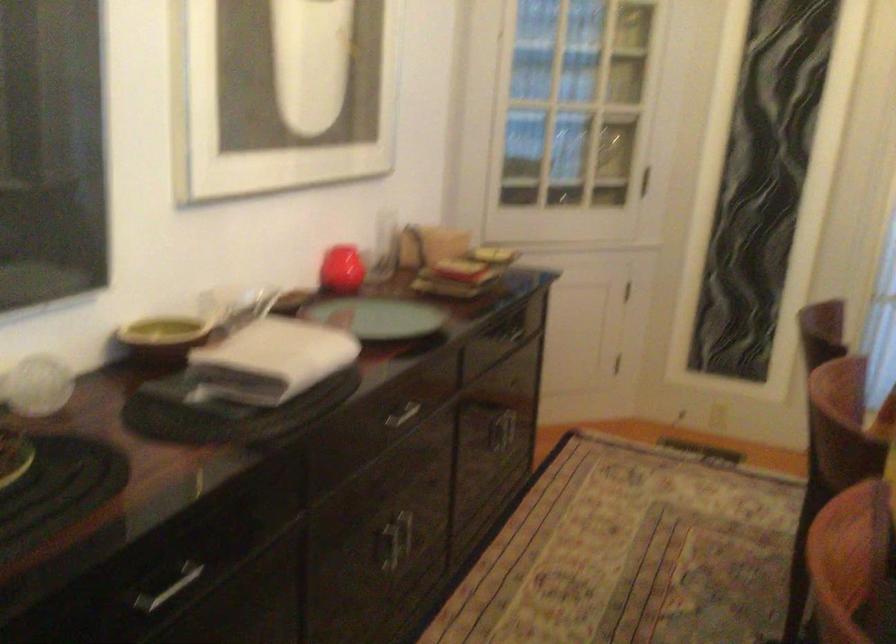
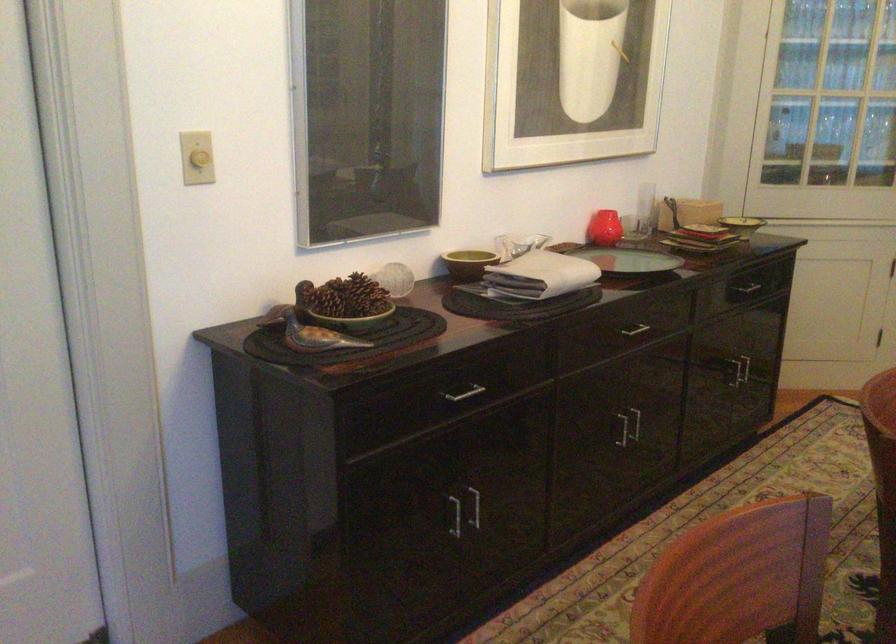
The point at (400,526) is marked in the first image. Where is the corresponding point in the second image?

(635, 422)